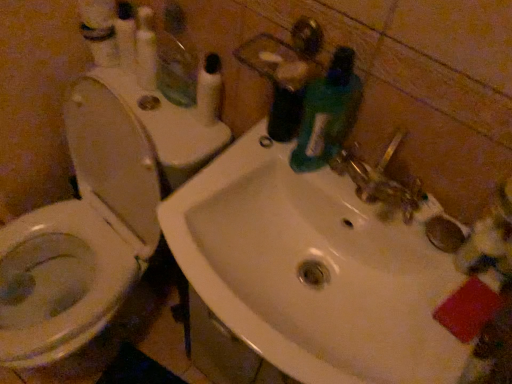
Question: Is white glossy toilet at left facing towards white plastic pump at upper center?

Choices:
 (A) yes
 (B) no

Answer: (B)

Question: Considering the relative positions of white glossy toilet at left and white plastic pump at upper center in the image provided, is white glossy toilet at left to the right of white plastic pump at upper center from the viewer's perspective?

Choices:
 (A) yes
 (B) no

Answer: (B)

Question: From a real-world perspective, is white glossy toilet at left over white plastic pump at upper center?

Choices:
 (A) yes
 (B) no

Answer: (B)

Question: Can you confirm if white glossy toilet at left is smaller than white plastic pump at upper center?

Choices:
 (A) yes
 (B) no

Answer: (B)

Question: Is white glossy toilet at left with white plastic pump at upper center?

Choices:
 (A) yes
 (B) no

Answer: (B)

Question: Is white plastic pump at upper center spatially inside white glossy sink at center, or outside of it?

Choices:
 (A) outside
 (B) inside

Answer: (A)

Question: From a real-world perspective, is white plastic pump at upper center physically located above or below white glossy sink at center?

Choices:
 (A) below
 (B) above

Answer: (B)

Question: Considering the positions of point (209, 102) and point (369, 271), is point (209, 102) closer or farther from the camera than point (369, 271)?

Choices:
 (A) farther
 (B) closer

Answer: (A)

Question: Considering their positions, is white plastic pump at upper center located in front of or behind white glossy sink at center?

Choices:
 (A) behind
 (B) front

Answer: (A)

Question: Which is correct: white glossy toilet at left is inside white plastic pump at upper center, or outside of it?

Choices:
 (A) outside
 (B) inside

Answer: (A)

Question: From a real-world perspective, relative to white plastic pump at upper center, is white glossy toilet at left vertically above or below?

Choices:
 (A) above
 (B) below

Answer: (B)

Question: Relative to white plastic pump at upper center, is white glossy toilet at left in front or behind?

Choices:
 (A) behind
 (B) front

Answer: (B)

Question: Is point click(x=102, y=200) closer or farther from the camera than point click(x=217, y=114)?

Choices:
 (A) farther
 (B) closer

Answer: (A)

Question: From a real-world perspective, is white plastic pump at upper center physically located above or below clear glass mirror at upper left?

Choices:
 (A) below
 (B) above

Answer: (A)

Question: Is white plastic pump at upper center bigger or smaller than clear glass mirror at upper left?

Choices:
 (A) small
 (B) big

Answer: (A)